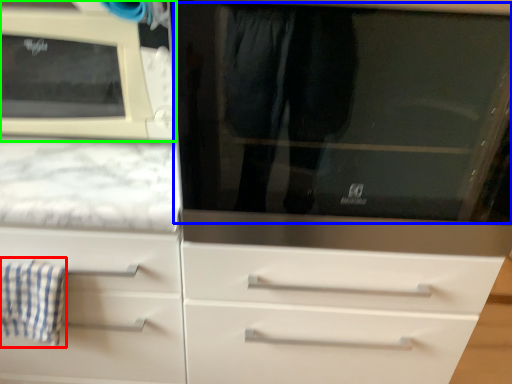
Question: Considering the real-world distances, which object is closest to bath towel (highlighted by a red box)? glass door (highlighted by a blue box) or microwave oven (highlighted by a green box).

Choices:
 (A) glass door
 (B) microwave oven

Answer: (B)